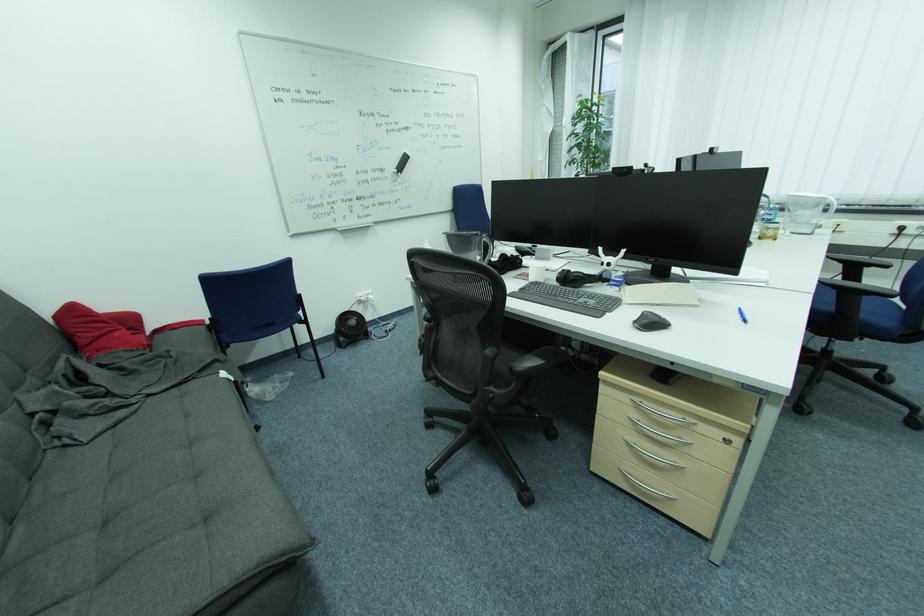
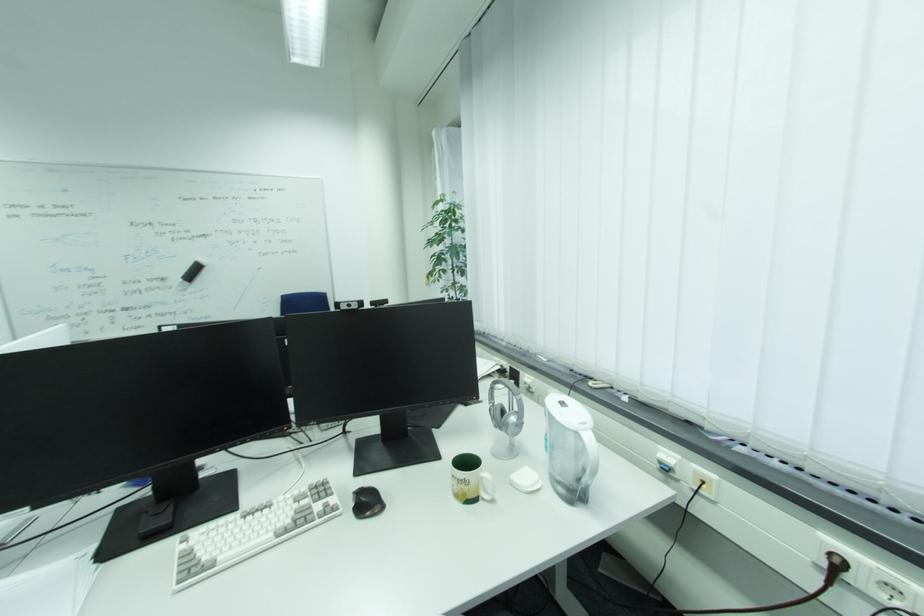
In the second image, find the point that corresponds to point (784, 237) in the first image.

(490, 496)